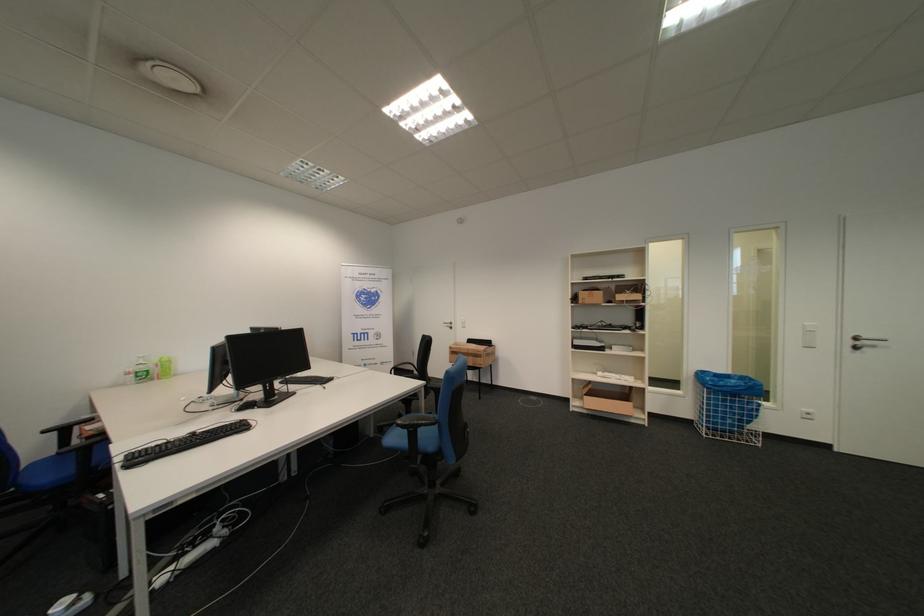
Find the location of a particular element. clear sanitizer bottle is located at coordinates (141, 369).